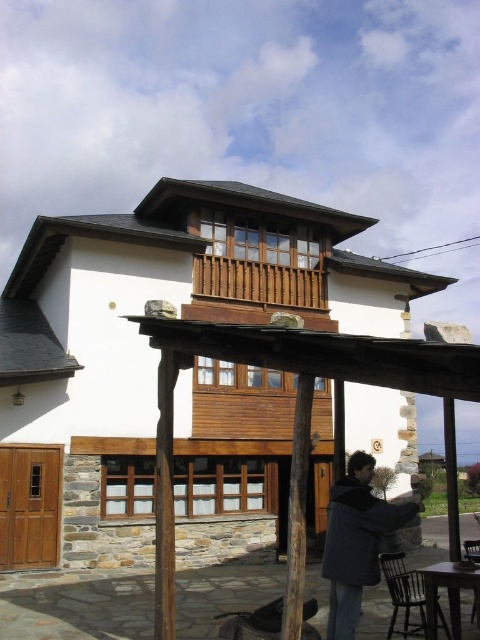
Is wooden pergola at center positioned behind wooden at upper center?

That is False.

Does wooden pergola at center have a lesser height compared to wooden at upper center?

Incorrect, wooden pergola at center's height does not fall short of wooden at upper center's.

This screenshot has height=640, width=480. In order to click on wooden pergola at center in this screenshot , I will do `click(143, 349)`.

Can you confirm if wooden pergola at center is taller than dark gray jacket at center?

Correct, wooden pergola at center is much taller as dark gray jacket at center.

Does point (282, 458) come farther from viewer compared to point (354, 515)?

That is True.

Is point (141, 291) positioned before point (345, 541)?

No, it is not.

Identify the location of wooden pergola at center. (143, 349).

Is point (334, 493) farther from viewer compared to point (224, 285)?

No, it is not.

Is dark gray jacket at center shorter than wooden at upper center?

Incorrect, dark gray jacket at center's height does not fall short of wooden at upper center's.

Does point (346, 490) come behind point (232, 268)?

No.

Locate an element on the screen. dark gray jacket at center is located at coordinates 356,541.